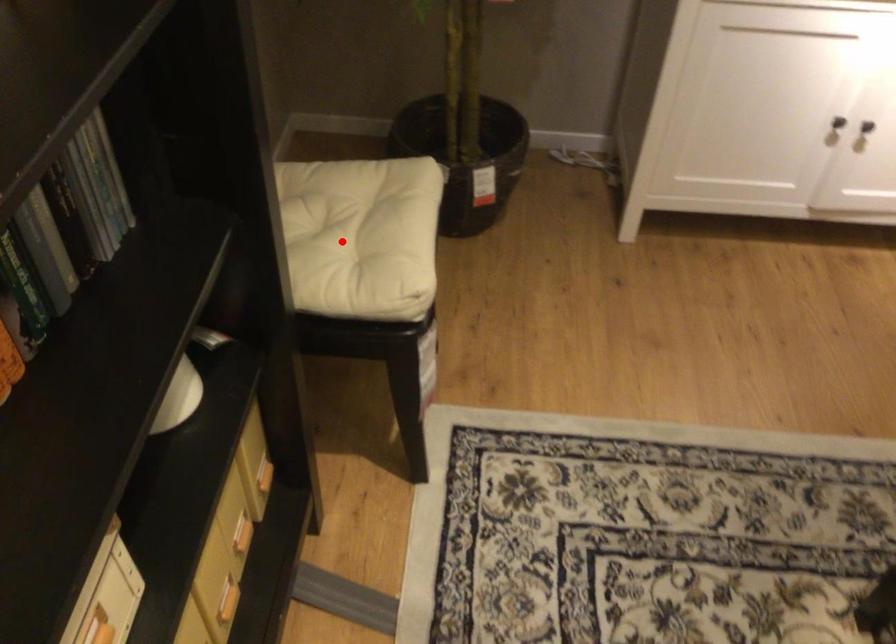
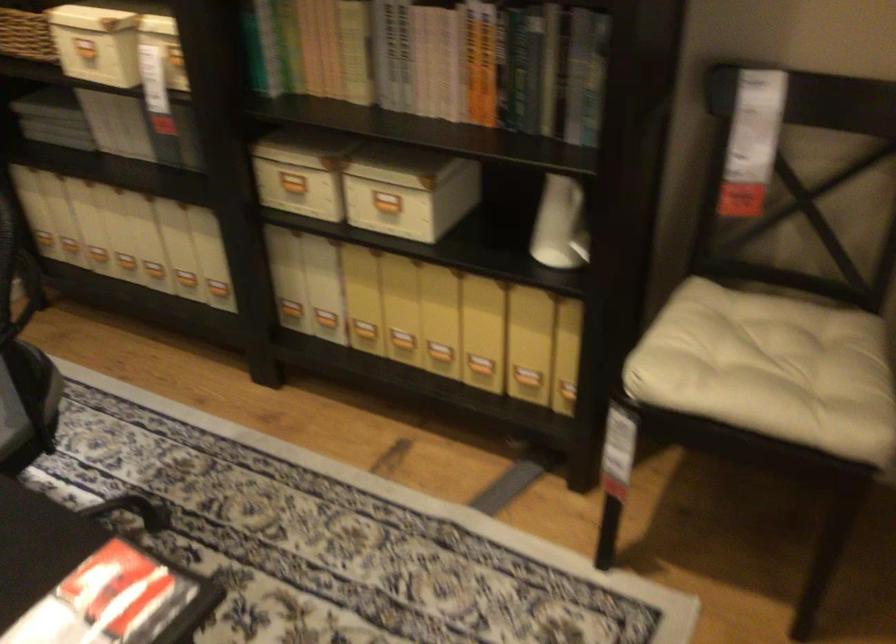
In the second image, find the point that corresponds to the highlighted location in the first image.

(776, 366)